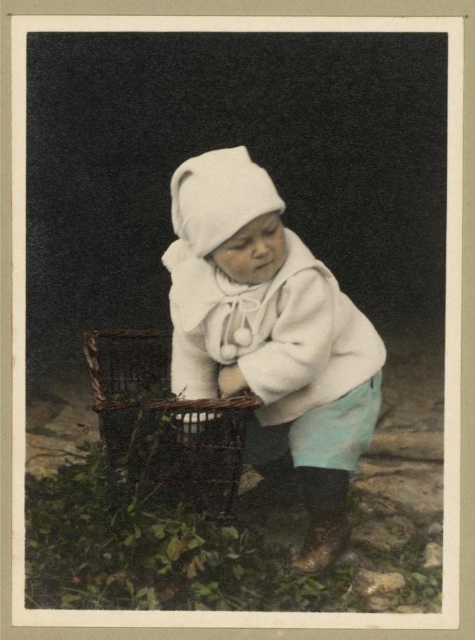
Question: Among these points, which one is farthest from the camera?

Choices:
 (A) (298, 410)
 (B) (155, 353)

Answer: (B)

Question: Does white soft cloth at center have a lesser width compared to woven brown basket at lower left?

Choices:
 (A) no
 (B) yes

Answer: (A)

Question: From the image, what is the correct spatial relationship of white soft cloth at center in relation to woven brown basket at lower left?

Choices:
 (A) left
 (B) right

Answer: (B)

Question: Is white soft cloth at center closer to the viewer compared to woven brown basket at lower left?

Choices:
 (A) yes
 (B) no

Answer: (B)